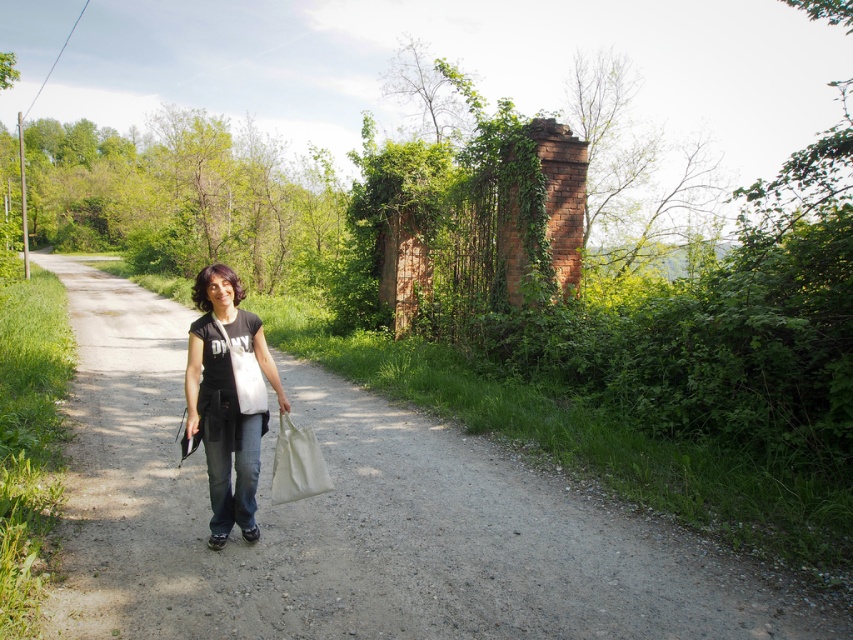
Question: Which point appears closest to the camera in this image?

Choices:
 (A) (286, 435)
 (B) (775, 611)
 (C) (256, 413)

Answer: (B)

Question: Is black matte shirt at center wider than white canvas bag at center?

Choices:
 (A) yes
 (B) no

Answer: (A)

Question: Does gravel path at center have a lesser width compared to white canvas bag at center?

Choices:
 (A) yes
 (B) no

Answer: (B)

Question: Which of these objects is positioned closest to the gravel path at center?

Choices:
 (A) white canvas bag at center
 (B) black matte shirt at center

Answer: (A)

Question: Which point is farther to the camera?

Choices:
 (A) gravel path at center
 (B) white canvas bag at center

Answer: (B)

Question: Can you confirm if gravel path at center is thinner than black matte shirt at center?

Choices:
 (A) no
 (B) yes

Answer: (A)